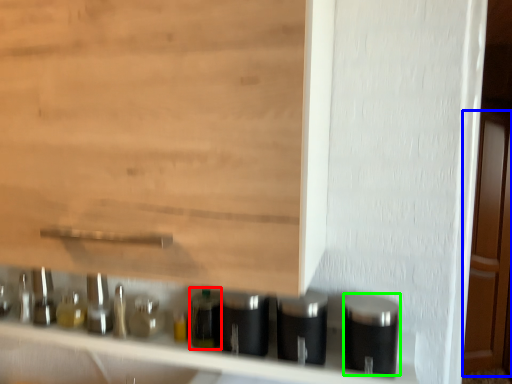
Question: Which is nearer to the bottle (highlighted by a red box)? door (highlighted by a blue box) or silver (highlighted by a green box).

Choices:
 (A) door
 (B) silver

Answer: (B)